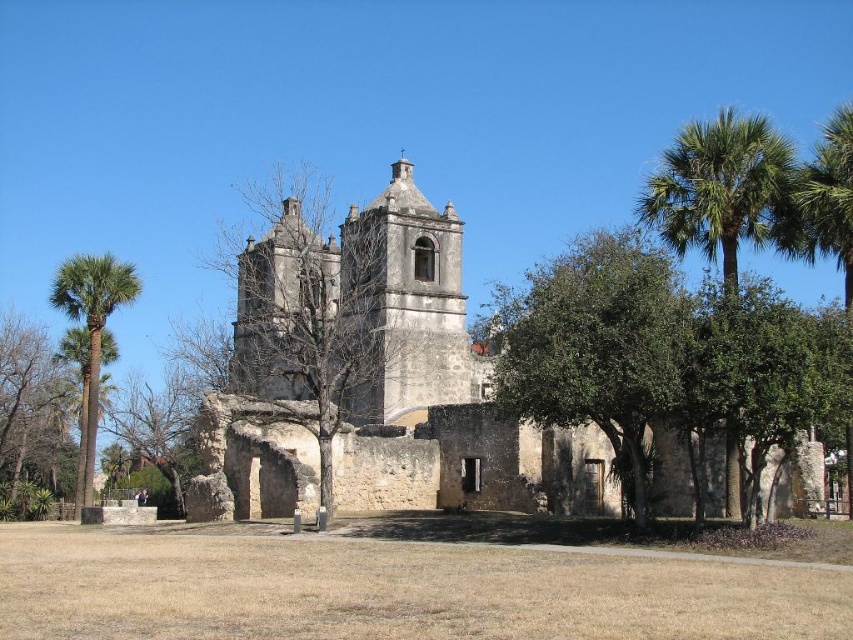
You are standing in front of the historic stone building and want to take a photo that includes both the green leafy tree at center and the brown rough stone tower at center. Which object should you position closer to the front of your photo to ensure both are fully visible?

The green leafy tree at center is shorter than the brown rough stone tower at center, so you should position the green leafy tree at center closer to the front of your photo to ensure both are fully visible.

You are standing in front of the historic stone building and notice the green leafy tree at center and the brown rough stone tower at center. Which object is positioned higher in the scene?

The green leafy tree at center is located above the brown rough stone tower at center, so it is positioned higher in the scene.